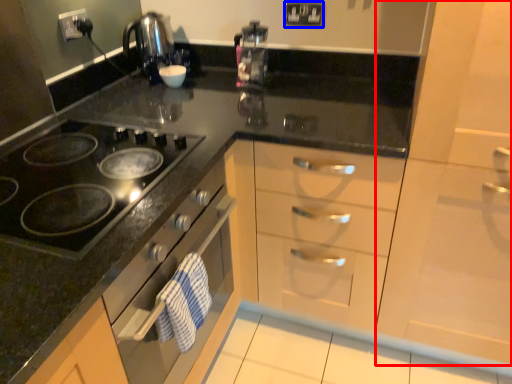
Question: Which object is further to the camera taking this photo, cabinetry (highlighted by a red box) or electric outlet (highlighted by a blue box)?

Choices:
 (A) cabinetry
 (B) electric outlet

Answer: (B)